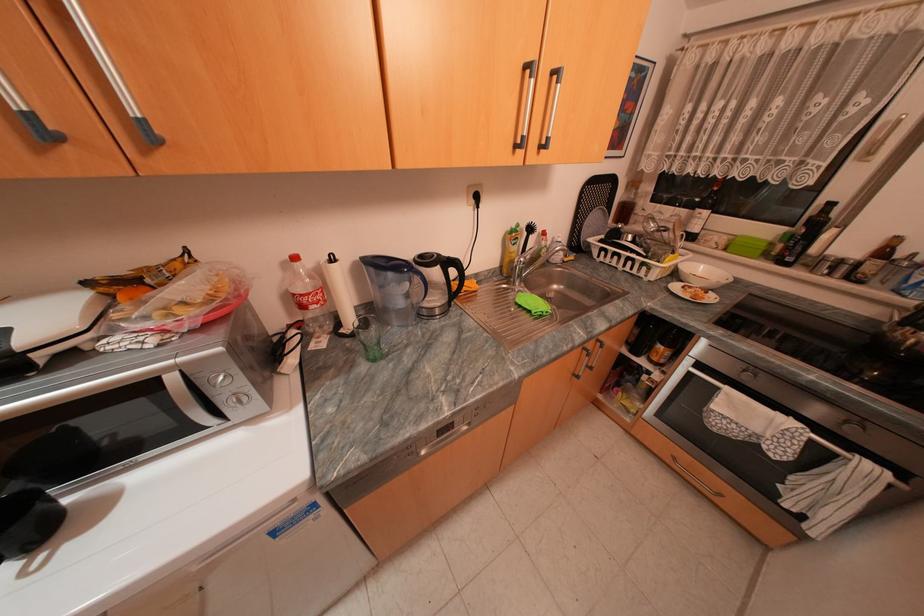
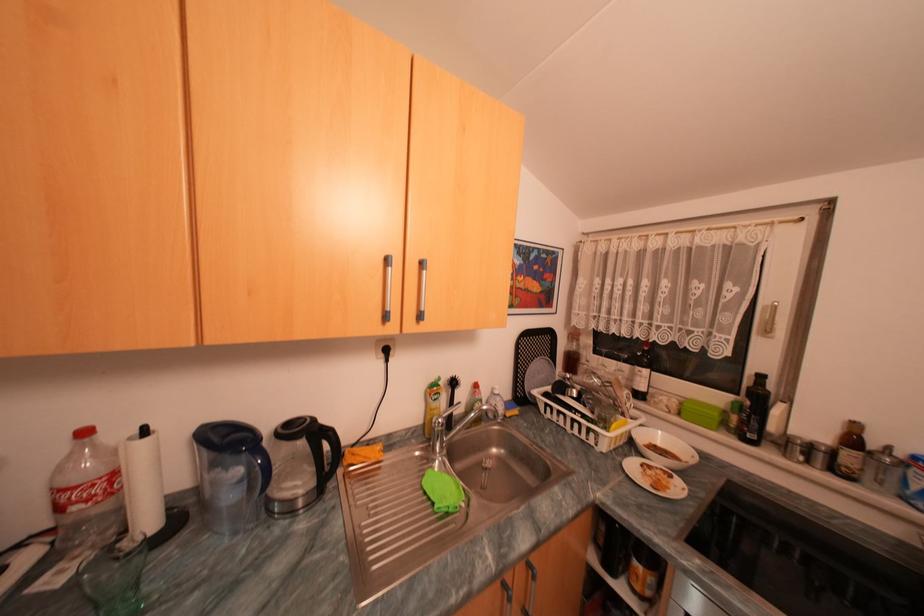
In the second image, find the point that corresponds to point 694,209 in the first image.

(636, 366)